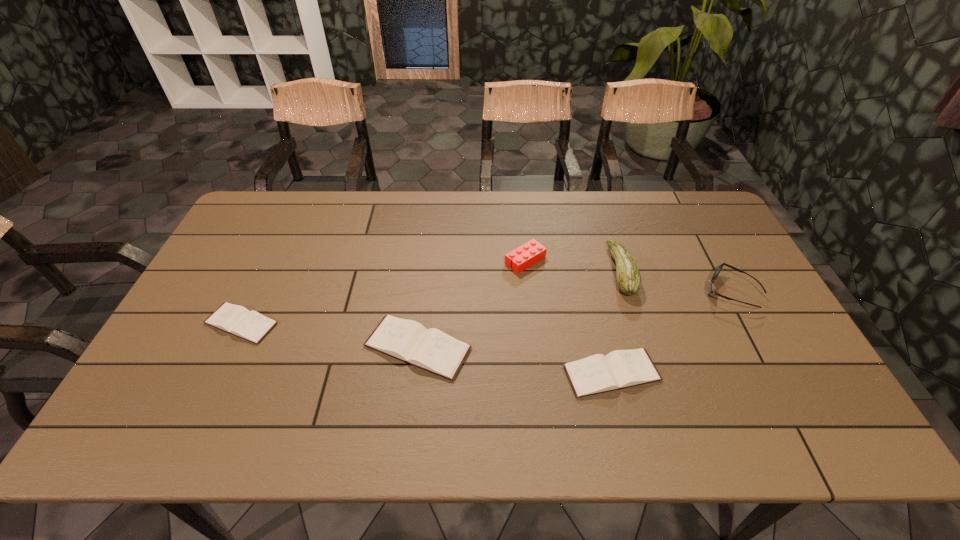
The image size is (960, 540). Find the location of `vacant space located on the right of the rightmost diary`. vacant space located on the right of the rightmost diary is located at coordinates (772, 373).

Where is `vacant space located 0.220m at the front of the rightmost object showing the lenses`? The image size is (960, 540). vacant space located 0.220m at the front of the rightmost object showing the lenses is located at coordinates (627, 292).

Locate an element on the screen. The height and width of the screenshot is (540, 960). vacant space located 0.320m at the front of the rightmost object showing the lenses is located at coordinates (592, 292).

The height and width of the screenshot is (540, 960). I want to click on vacant space positioned 0.300m at the front of the rightmost object showing the lenses, so click(599, 292).

The height and width of the screenshot is (540, 960). Find the location of `free space located 0.330m at the stem end of the zucchini`. free space located 0.330m at the stem end of the zucchini is located at coordinates 502,271.

Find the location of a particular element. This screenshot has height=540, width=960. free space located at the stem end of the zucchini is located at coordinates (515, 271).

Locate an element on the screen. The image size is (960, 540). free space located 0.280m at the stem end of the zucchini is located at coordinates (518, 271).

I want to click on vacant space located on the left of the Lego, so click(x=456, y=260).

Locate an element on the screen. Image resolution: width=960 pixels, height=540 pixels. object at the left edge is located at coordinates (234, 319).

The image size is (960, 540). Find the location of `object that is at the right edge`. object that is at the right edge is located at coordinates (719, 268).